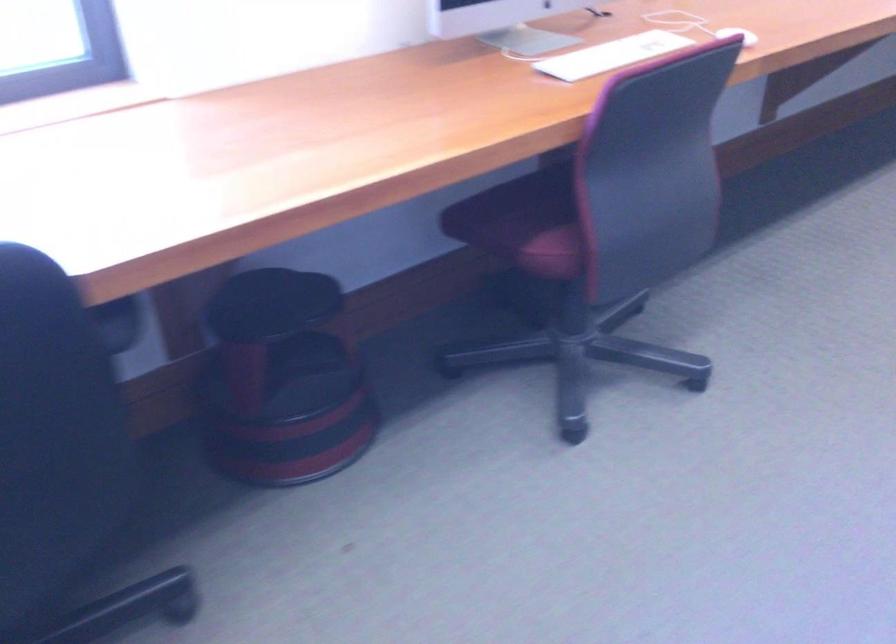
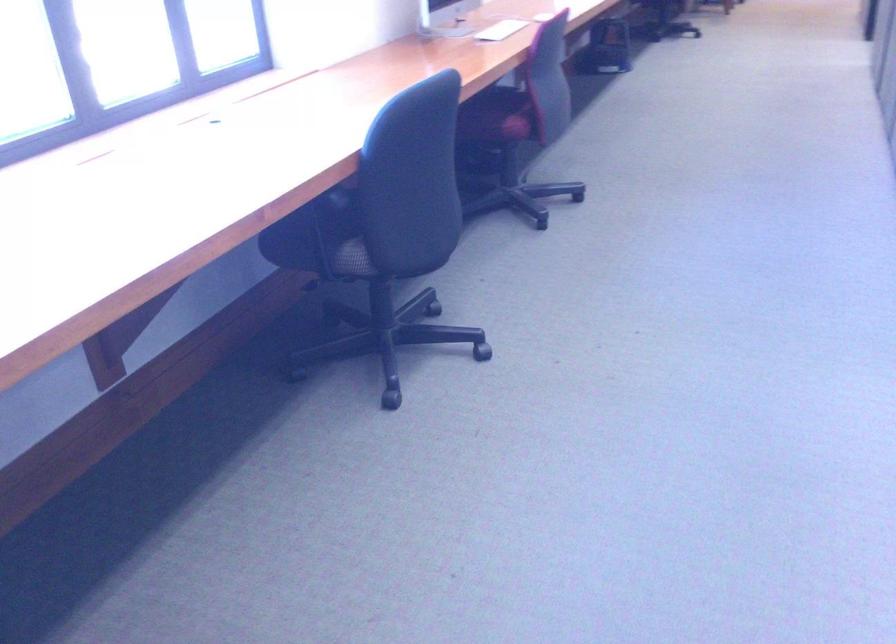
The point at (576, 69) is marked in the first image. Where is the corresponding point in the second image?

(501, 30)